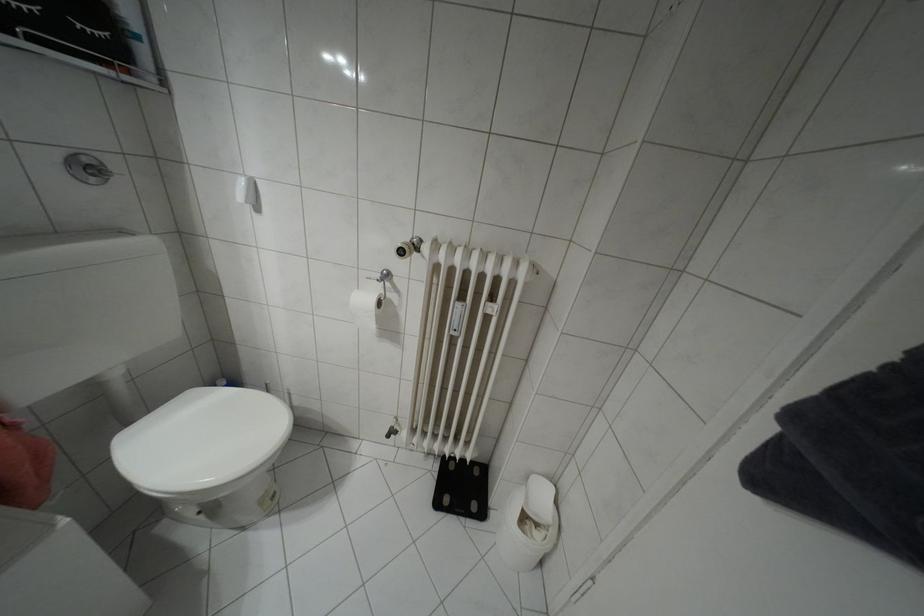
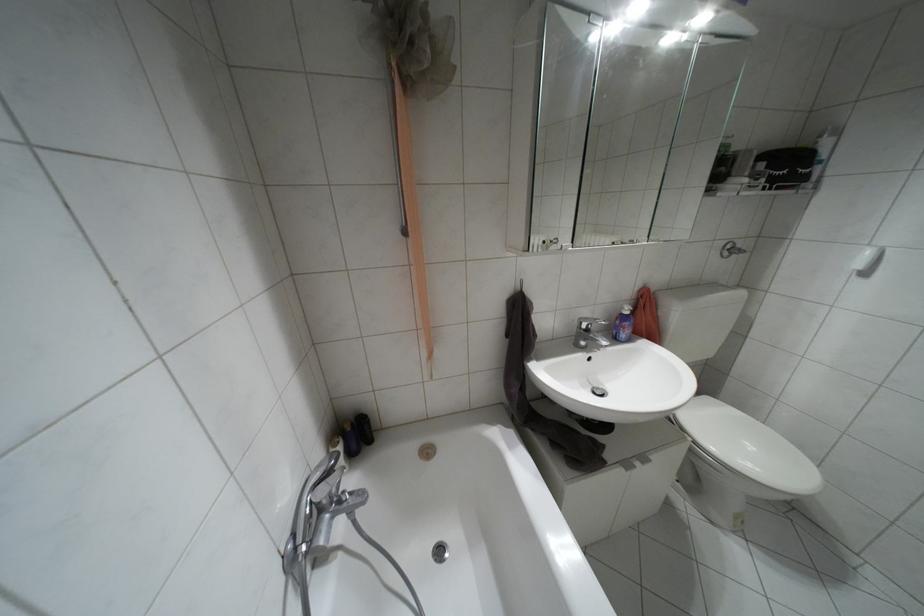
Locate, in the second image, the point that corresponds to [92,179] in the first image.

(723, 254)